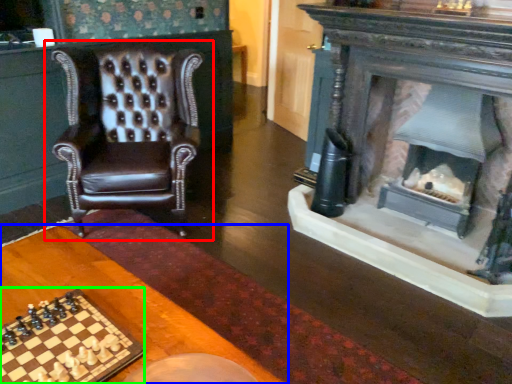
Question: Which object is the farthest from chair (highlighted by a red box)? Choose among these: table (highlighted by a blue box) or board game (highlighted by a green box).

Choices:
 (A) table
 (B) board game

Answer: (B)